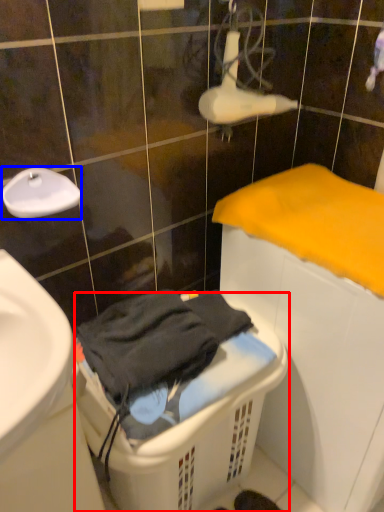
Question: Which object appears farthest to the camera in this image, laundry basket (highlighted by a red box) or faucet (highlighted by a blue box)?

Choices:
 (A) laundry basket
 (B) faucet

Answer: (B)